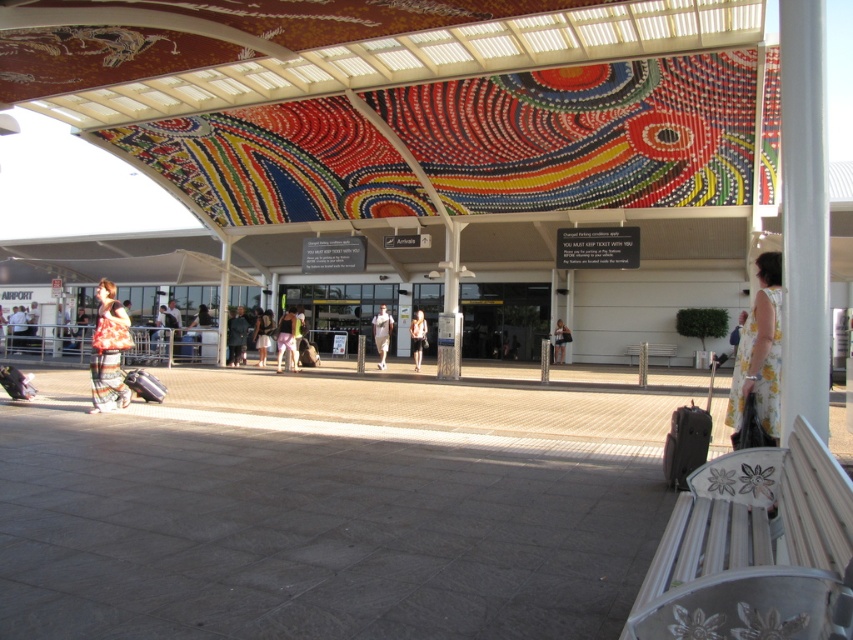
Question: Estimate the real-world distances between objects in this image. Which object is closer to the dark gray fabric pants at center?

Choices:
 (A) yellow floral dress at right
 (B) light brown leather handbag at center
 (C) matte black suitcase at lower right

Answer: (B)

Question: Which point is farther to the camera?

Choices:
 (A) (376, 320)
 (B) (99, 394)
 (C) (289, 330)

Answer: (A)

Question: Does dark gray fabric pants at center have a lesser width compared to white cotton dress at center?

Choices:
 (A) yes
 (B) no

Answer: (B)

Question: Is matte black suitcase at lower left thinner than light beige fabric dress at center?

Choices:
 (A) no
 (B) yes

Answer: (B)

Question: Is the position of matte black suitcase at lower right more distant than that of light beige fabric dress at center?

Choices:
 (A) yes
 (B) no

Answer: (B)

Question: Which point appears closest to the camera in this image?

Choices:
 (A) (425, 342)
 (B) (236, 358)

Answer: (A)